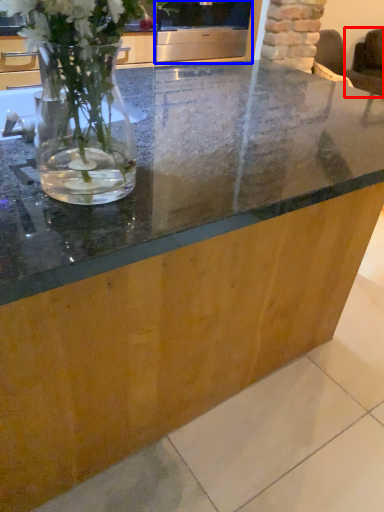
Question: Which object appears closest to the camera in this image, armchair (highlighted by a red box) or appliance (highlighted by a blue box)?

Choices:
 (A) armchair
 (B) appliance

Answer: (B)